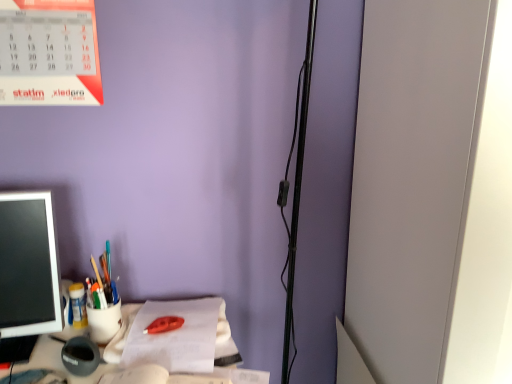
Identify the location of blank space situated above white paper at center (from a real-world perspective). (174, 326).